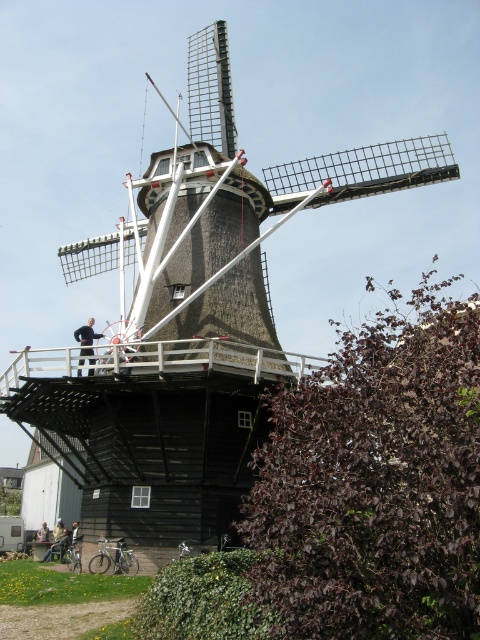
Can you confirm if dark blue jeans at lower left is positioned below dark brown leather jacket at center?

Incorrect, dark blue jeans at lower left is not positioned below dark brown leather jacket at center.

Can you confirm if dark blue jeans at lower left is thinner than dark brown leather jacket at center?

No.

Who is more forward, [60,536] or [43,532]?

Positioned in front is point [60,536].

I want to click on dark blue jeans at lower left, so click(x=58, y=541).

This screenshot has height=640, width=480. Describe the element at coordinates (86, 337) in the screenshot. I see `black fabric jacket at upper left` at that location.

Can you confirm if black fabric jacket at upper left is shorter than dark brown leather jacket at center?

No.

Locate an element on the screen. Image resolution: width=480 pixels, height=640 pixels. black fabric jacket at upper left is located at coordinates (86, 337).

Between black fabric jacket at upper left and dark blue jeans at lower left, which one has less height?

Standing shorter between the two is dark blue jeans at lower left.

Measure the distance between black fabric jacket at upper left and camera.

The distance of black fabric jacket at upper left from camera is 61.63 meters.

Is point (79, 364) behind point (60, 544)?

No, it is not.

You are a GUI agent. You are given a task and a screenshot of the screen. Output one action in this format:
    pyautogui.click(x=<x>, y=<y>)
    Task: Click on the black fabric jacket at upper left
    This screenshot has height=640, width=480.
    Given the screenshot: What is the action you would take?
    pyautogui.click(x=86, y=337)